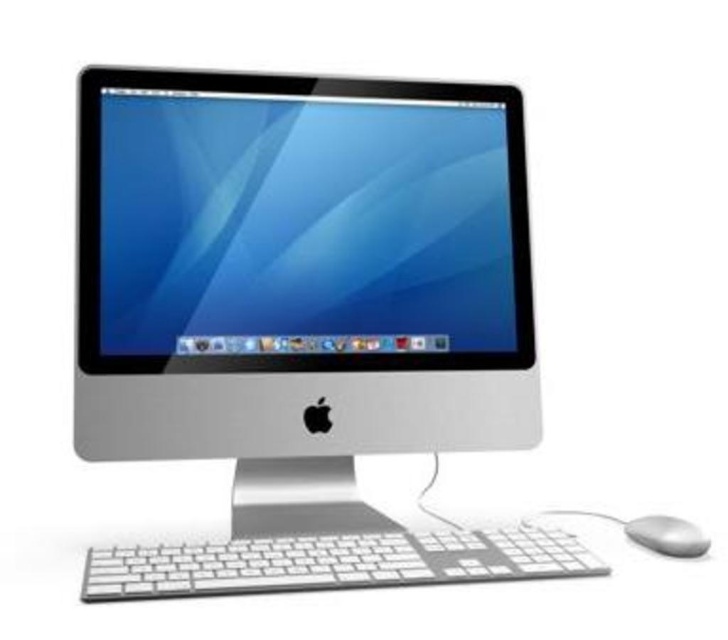
Question: Observing the image, what is the correct spatial positioning of white plastic keyboard at lower center in reference to satin silver mouse at lower right?

Choices:
 (A) below
 (B) above

Answer: (A)

Question: Which object is the closest to the satin silver mouse at lower right?

Choices:
 (A) white plastic keyboard at lower center
 (B) sleek silver monitor at center

Answer: (A)

Question: Estimate the real-world distances between objects in this image. Which object is farther from the white plastic keyboard at lower center?

Choices:
 (A) sleek silver monitor at center
 (B) satin silver mouse at lower right

Answer: (B)

Question: Which of these objects is positioned closest to the satin silver mouse at lower right?

Choices:
 (A) white plastic keyboard at lower center
 (B) sleek silver monitor at center

Answer: (A)

Question: Is white plastic keyboard at lower center positioned in front of satin silver mouse at lower right?

Choices:
 (A) yes
 (B) no

Answer: (A)

Question: Is sleek silver monitor at center bigger than satin silver mouse at lower right?

Choices:
 (A) yes
 (B) no

Answer: (A)